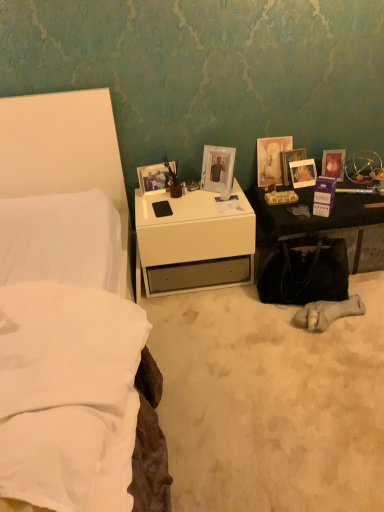
This screenshot has width=384, height=512. What are the coordinates of `free spot above black glossy nightstand at right (from a real-world perspective)` in the screenshot? It's located at (336, 200).